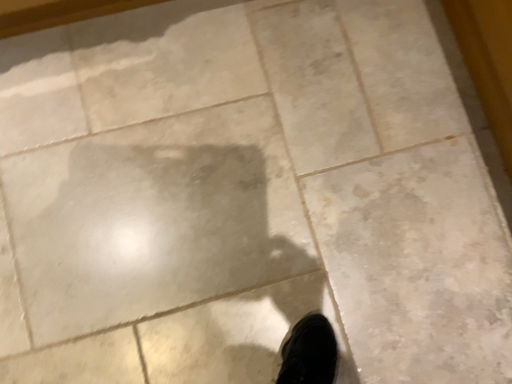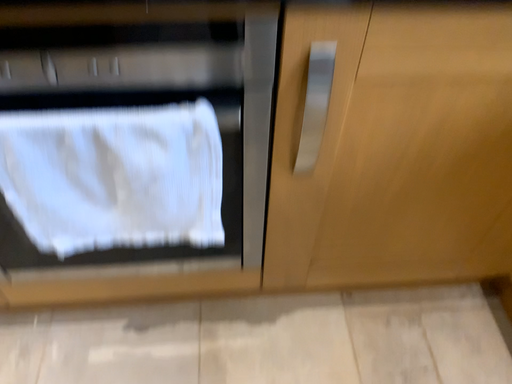
Question: How did the camera likely rotate when shooting the video?

Choices:
 (A) rotated downward
 (B) rotated upward

Answer: (B)